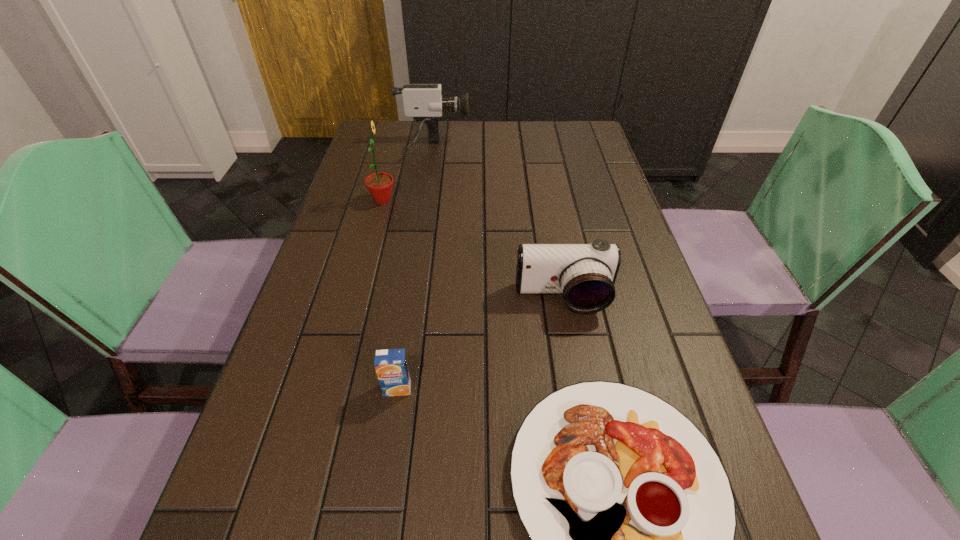
Where is `the tallest object`? The image size is (960, 540). the tallest object is located at coordinates (379, 185).

Identify the location of the fourth nearest object. (379, 185).

Image resolution: width=960 pixels, height=540 pixels. I want to click on the farthest object, so click(424, 102).

I want to click on the second tallest object, so click(424, 102).

The image size is (960, 540). I want to click on the nearer camcorder, so click(x=585, y=274).

Locate an element on the screen. The height and width of the screenshot is (540, 960). the shorter camcorder is located at coordinates (585, 274).

Where is `the second shortest object`? the second shortest object is located at coordinates (391, 366).

Where is `free space located on the face of the tallest object`? The width and height of the screenshot is (960, 540). free space located on the face of the tallest object is located at coordinates (444, 200).

Where is `vacant region located 0.190m on the recording direction of the left camcorder`? The width and height of the screenshot is (960, 540). vacant region located 0.190m on the recording direction of the left camcorder is located at coordinates (528, 148).

Locate an element on the screen. The width and height of the screenshot is (960, 540). free space located on the surface of the shorter camcorder is located at coordinates (570, 338).